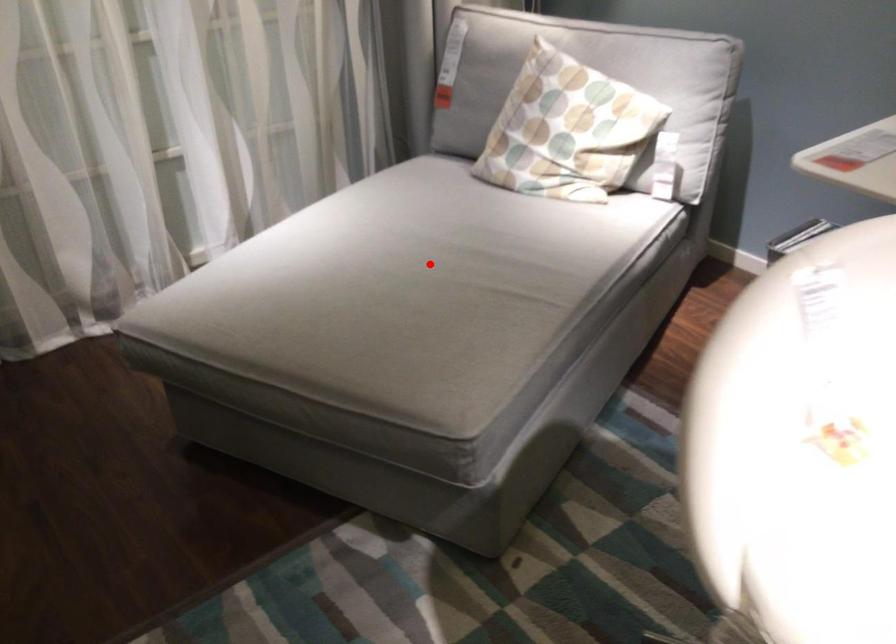
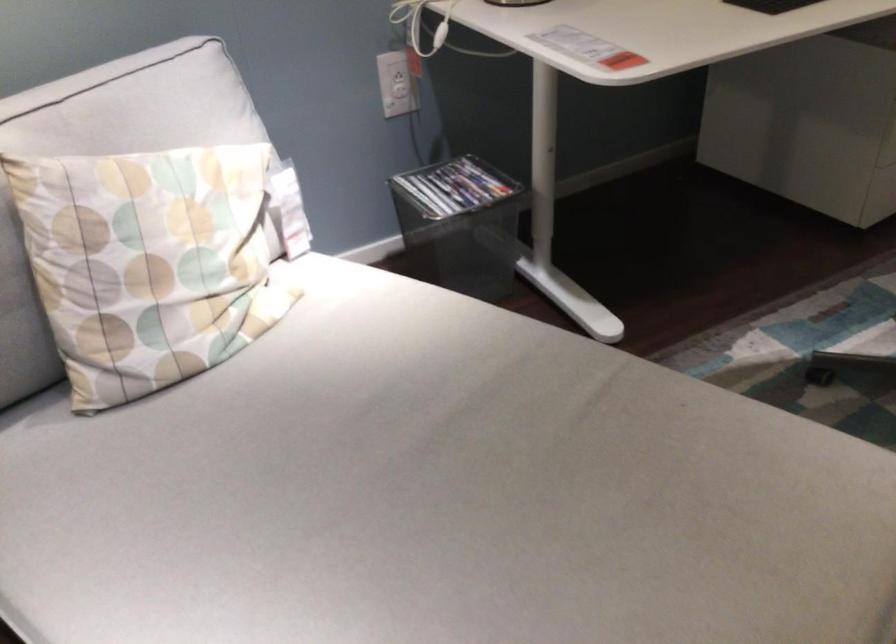
Question: I am providing you with two images of the same scene from different viewpoints. Image1 has a red point marked. In image2, the corresponding 3D location appears at what relative position? Reply with the corresponding letter.

Choices:
 (A) Closer
 (B) Farther

Answer: (A)